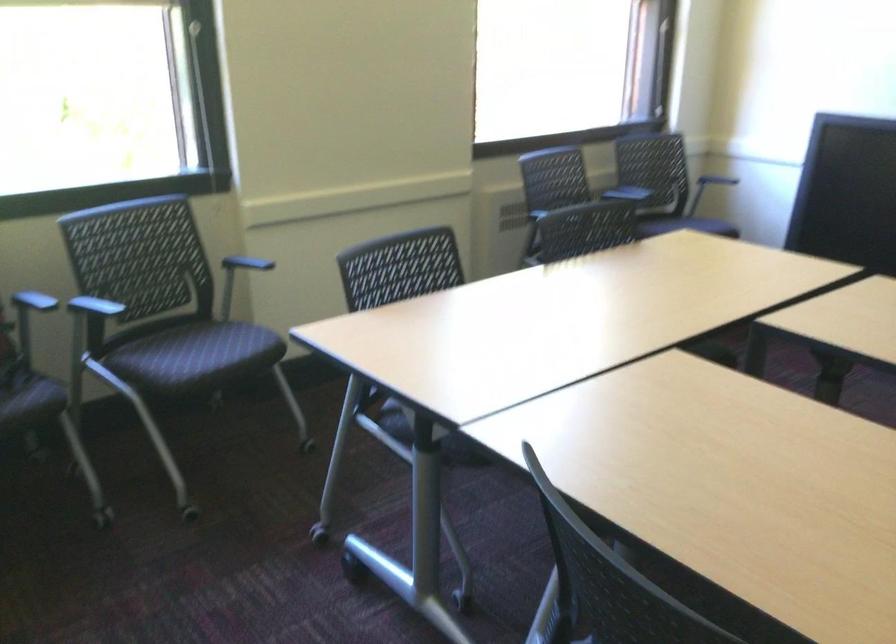
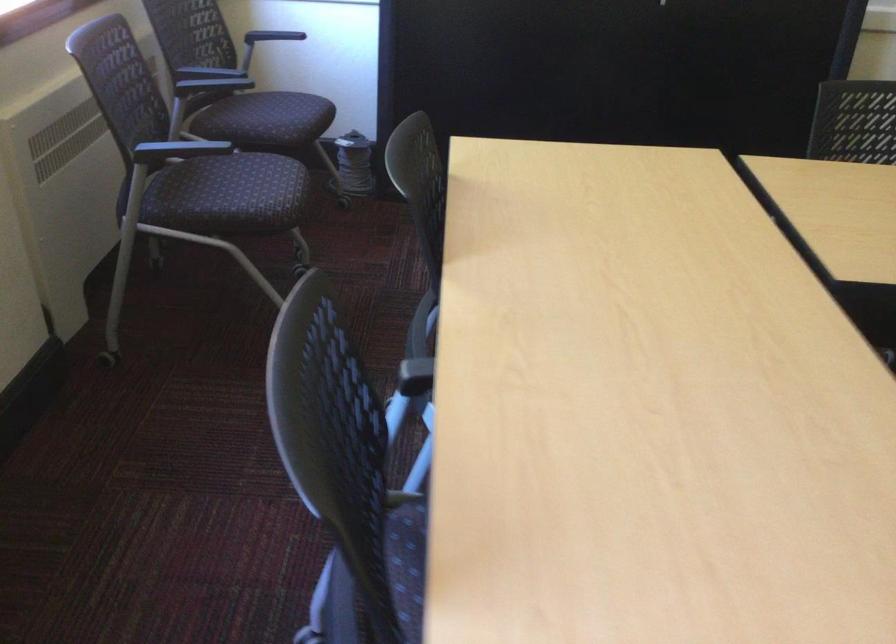
Find the pixel in the second image that matches point (659, 223) in the first image.

(271, 120)